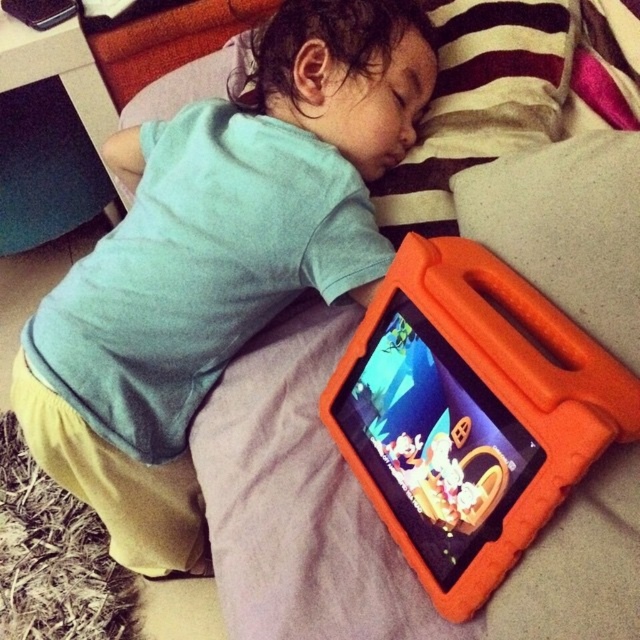
What are the coordinates of the matte orange tablet at lower right?

The matte orange tablet at lower right is located at point (216, 260).

You are a parent trying to hand your child a new book. The book is 10 inches wide. You see the matte orange tablet at lower right and the orange foam tablet at lower right. Can you place the book between them?

The distance between the matte orange tablet at lower right and the orange foam tablet at lower right is 10.57 inches. Since the book is 10 inches wide, it can fit between them as the space is slightly larger than the book.

You are a parent trying to hand your child a new book. The book is on the nightstand next to the matte orange tablet at lower right and orange foam tablet at lower right. Which tablet should you move to reach the book?

You should move the matte orange tablet at lower right because it is closer to you than the orange foam tablet at lower right, so moving it first would allow you to access the book on the nightstand.